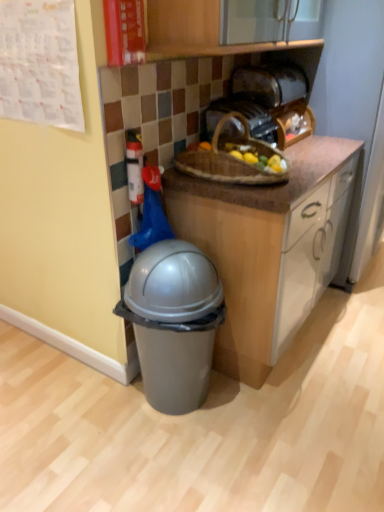
Question: Is brown woven picnic basket at center thinner than wooden basket at upper center, arranged as the 1th toaster when ordered from the bottom?

Choices:
 (A) no
 (B) yes

Answer: (A)

Question: Is brown woven picnic basket at center at the right side of wooden basket at upper center, which appears as the second toaster when viewed from the top?

Choices:
 (A) no
 (B) yes

Answer: (A)

Question: From the image's perspective, is brown woven picnic basket at center located above wooden basket at upper center, arranged as the 1th toaster when ordered from the bottom?

Choices:
 (A) no
 (B) yes

Answer: (A)

Question: Does brown woven picnic basket at center have a lesser height compared to wooden basket at upper center, arranged as the 1th toaster when ordered from the bottom?

Choices:
 (A) yes
 (B) no

Answer: (B)

Question: From a real-world perspective, is brown woven picnic basket at center physically below wooden basket at upper center, arranged as the 1th toaster when ordered from the bottom?

Choices:
 (A) no
 (B) yes

Answer: (B)

Question: Does point (173, 385) appear closer or farther from the camera than point (296, 70)?

Choices:
 (A) farther
 (B) closer

Answer: (B)

Question: Is gray plastic trash can at lower left in front of or behind satin gold toaster at upper center, the second toaster ordered from the bottom, in the image?

Choices:
 (A) front
 (B) behind

Answer: (A)

Question: Would you say gray plastic trash can at lower left is inside or outside satin gold toaster at upper center, the second toaster ordered from the bottom?

Choices:
 (A) outside
 (B) inside

Answer: (A)

Question: Considering the positions of gray plastic trash can at lower left and satin gold toaster at upper center, the second toaster ordered from the bottom, in the image, is gray plastic trash can at lower left bigger or smaller than satin gold toaster at upper center, the second toaster ordered from the bottom,?

Choices:
 (A) big
 (B) small

Answer: (A)

Question: Is white plastic fire extinguisher at upper left situated inside gray plastic trash can at lower left or outside?

Choices:
 (A) inside
 (B) outside

Answer: (B)

Question: Would you say white plastic fire extinguisher at upper left is to the left or to the right of gray plastic trash can at lower left in the picture?

Choices:
 (A) right
 (B) left

Answer: (B)

Question: Is point (127, 165) positioned closer to the camera than point (170, 350)?

Choices:
 (A) farther
 (B) closer

Answer: (B)

Question: Considering their positions, is white plastic fire extinguisher at upper left located in front of or behind gray plastic trash can at lower left?

Choices:
 (A) behind
 (B) front

Answer: (A)

Question: Is white plastic fire extinguisher at upper left inside or outside of brown woven picnic basket at center?

Choices:
 (A) outside
 (B) inside

Answer: (A)

Question: Based on their positions, is white plastic fire extinguisher at upper left located to the left or right of brown woven picnic basket at center?

Choices:
 (A) right
 (B) left

Answer: (B)